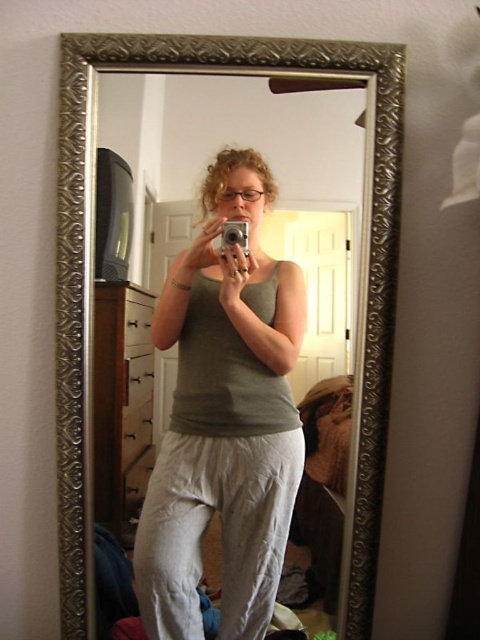
Who is positioned more to the left, gray cotton tank top at center or silver metallic mirror at center?

silver metallic mirror at center is more to the left.

Which is behind, point (269, 422) or point (335, 77)?

The point (269, 422) is more distant.

You are a GUI agent. You are given a task and a screenshot of the screen. Output one action in this format:
    pyautogui.click(x=<x>, y=<y>)
    Task: Click on the gray cotton tank top at center
    This screenshot has width=480, height=640.
    Given the screenshot: What is the action you would take?
    pyautogui.click(x=224, y=417)